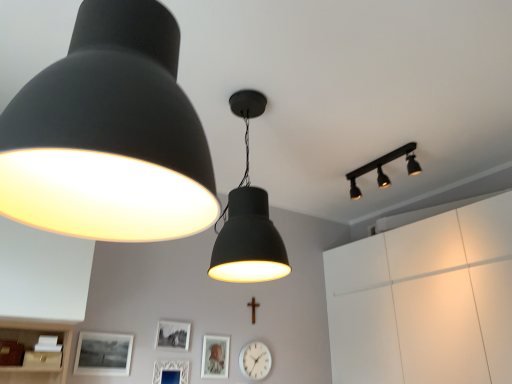
Question: Which direction should I rotate to look at matte silver picture frame at center, which appears as the fourth picture frame when viewed from the left?

Choices:
 (A) right
 (B) left

Answer: (B)

Question: Does matte black picture frame at lower left, positioned as the 4th picture frame in right-to-left order, have a greater width compared to matte silver picture frame at center, which ranks as the 1th picture frame in right-to-left order?

Choices:
 (A) no
 (B) yes

Answer: (B)

Question: From a real-world perspective, is matte black picture frame at lower left, marked as the first picture frame in a left-to-right arrangement, physically below matte silver picture frame at center, which ranks as the 1th picture frame in right-to-left order?

Choices:
 (A) no
 (B) yes

Answer: (A)

Question: Is matte black picture frame at lower left, marked as the first picture frame in a left-to-right arrangement, not close to matte silver picture frame at center, which ranks as the 1th picture frame in right-to-left order?

Choices:
 (A) yes
 (B) no

Answer: (B)

Question: Is matte black picture frame at lower left, positioned as the 4th picture frame in right-to-left order, turned away from matte silver picture frame at center, which ranks as the 1th picture frame in right-to-left order?

Choices:
 (A) no
 (B) yes

Answer: (A)

Question: Can you confirm if matte black picture frame at lower left, marked as the first picture frame in a left-to-right arrangement, is thinner than matte silver picture frame at center, which ranks as the 1th picture frame in right-to-left order?

Choices:
 (A) yes
 (B) no

Answer: (B)

Question: Is matte black picture frame at lower left, marked as the first picture frame in a left-to-right arrangement, not within matte silver picture frame at center, which ranks as the 1th picture frame in right-to-left order?

Choices:
 (A) no
 (B) yes

Answer: (B)

Question: Is the depth of matte black picture frame at lower center, arranged as the third picture frame when viewed from the right, less than that of matte black track light at upper right, which is counted as the 3th lamp, starting from the front?

Choices:
 (A) no
 (B) yes

Answer: (A)

Question: From the image's perspective, does matte black picture frame at lower center, which appears as the 2th picture frame when viewed from the left, appear higher than matte black track light at upper right, which is the 1th lamp in back-to-front order?

Choices:
 (A) no
 (B) yes

Answer: (A)

Question: Is matte black picture frame at lower center, which appears as the 2th picture frame when viewed from the left, bigger than matte black track light at upper right, which is the 1th lamp in back-to-front order?

Choices:
 (A) no
 (B) yes

Answer: (A)

Question: Is matte black picture frame at lower center, which appears as the 2th picture frame when viewed from the left, wider than matte black track light at upper right, which is counted as the 3th lamp, starting from the front?

Choices:
 (A) no
 (B) yes

Answer: (A)

Question: Is matte black track light at upper right, which is counted as the 3th lamp, starting from the front, completely or partially inside matte black picture frame at lower center, which appears as the 2th picture frame when viewed from the left?

Choices:
 (A) no
 (B) yes

Answer: (A)

Question: Can you confirm if matte black picture frame at lower center, arranged as the third picture frame when viewed from the right, is positioned to the left of matte black track light at upper right, which is the 1th lamp in back-to-front order?

Choices:
 (A) no
 (B) yes

Answer: (B)

Question: From a real-world perspective, is matte black track light at upper right, positioned as the 3th lamp in left-to-right order, physically above matte black lampshade at upper left, which appears as the 3th lamp when viewed from the right?

Choices:
 (A) yes
 (B) no

Answer: (A)